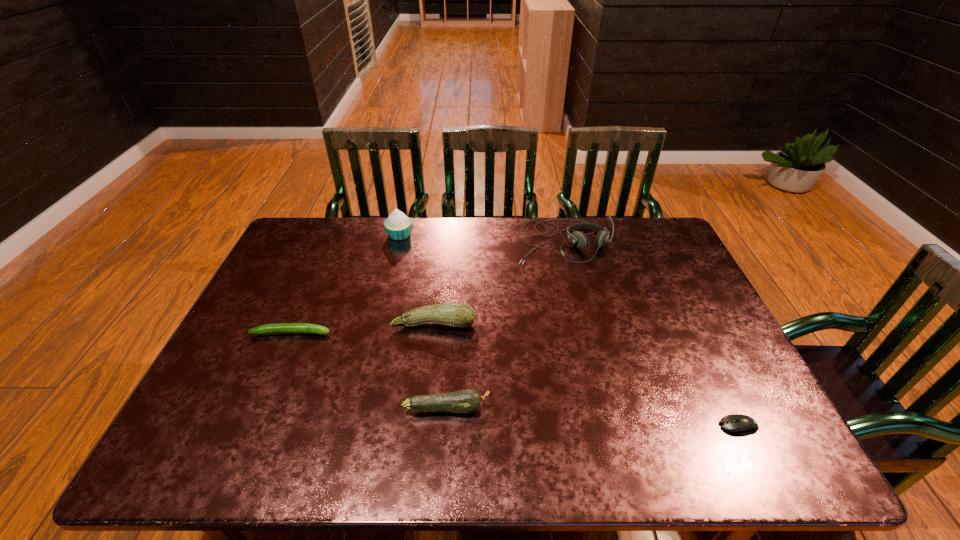
Locate an element on the screen. cupcake is located at coordinates (398, 226).

Find the location of a particular element. The image size is (960, 540). headset is located at coordinates (579, 239).

In order to click on the fifth shortest object in this screenshot , I will do `click(579, 239)`.

What are the coordinates of `the tallest zucchini` in the screenshot? It's located at [x=453, y=314].

Where is `the fourth tallest object`? The width and height of the screenshot is (960, 540). the fourth tallest object is located at coordinates (469, 400).

The width and height of the screenshot is (960, 540). In order to click on the second shortest zucchini in this screenshot , I will do `click(469, 400)`.

This screenshot has width=960, height=540. I want to click on the leftmost zucchini, so click(x=279, y=328).

The height and width of the screenshot is (540, 960). What are the coordinates of `the second shortest object` in the screenshot? It's located at (279, 328).

This screenshot has width=960, height=540. In order to click on the shortest object in this screenshot , I will do `click(740, 424)`.

You are a GUI agent. You are given a task and a screenshot of the screen. Output one action in this format:
    pyautogui.click(x=<x>, y=<y>)
    Task: Click on the computer mouse
    Image resolution: width=960 pixels, height=540 pixels.
    Given the screenshot: What is the action you would take?
    pyautogui.click(x=740, y=424)